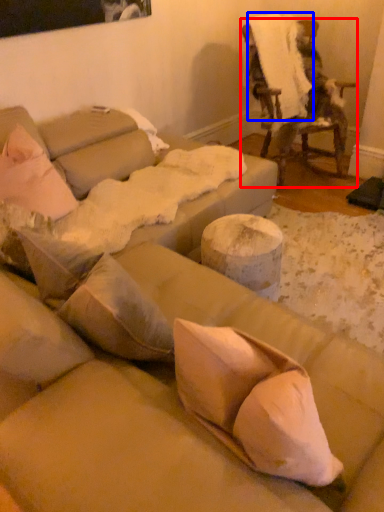
Question: Among these objects, which one is nearest to the camera, chair (highlighted by a red box) or linen (highlighted by a blue box)?

Choices:
 (A) chair
 (B) linen

Answer: (A)